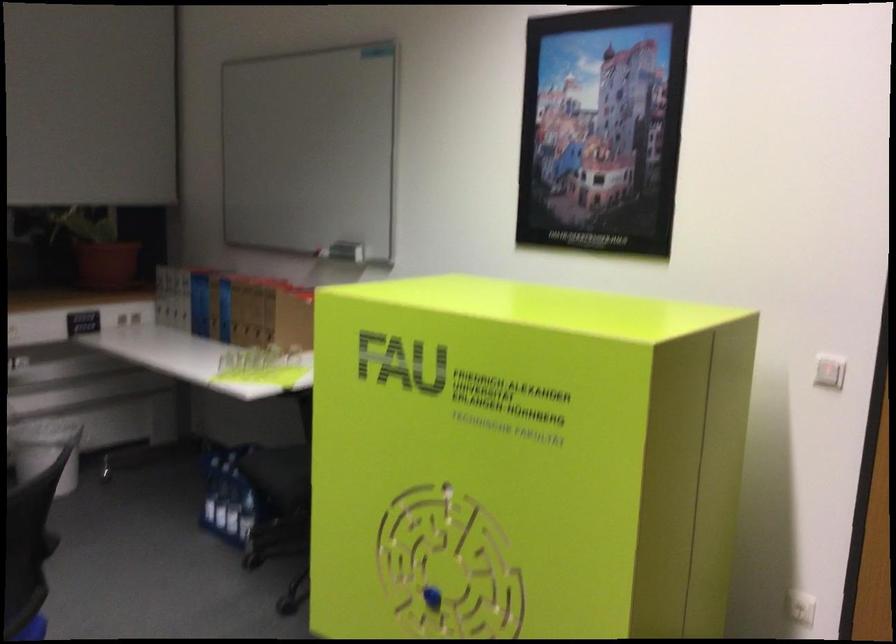
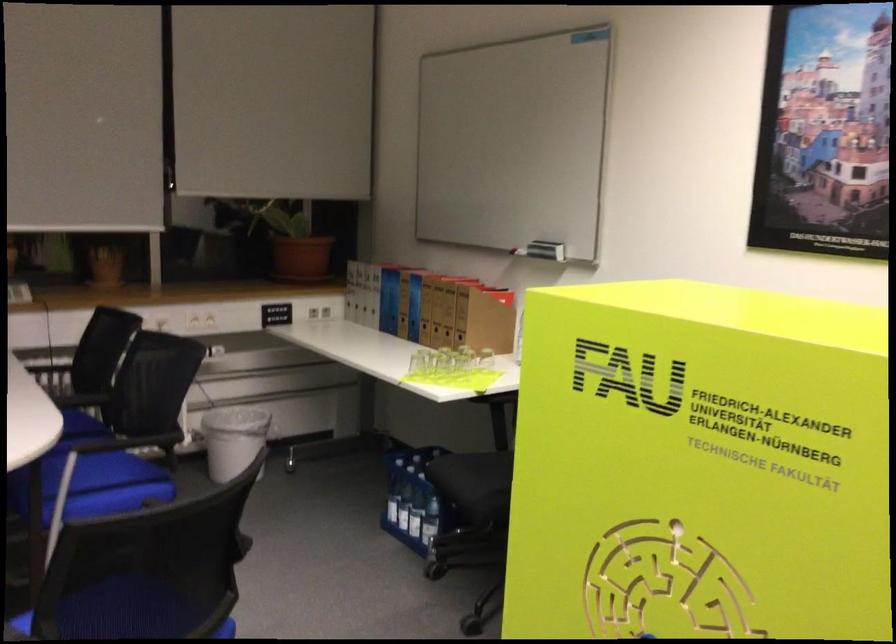
Where in the second image is the point corresponding to (x=227, y=363) from the first image?

(418, 363)